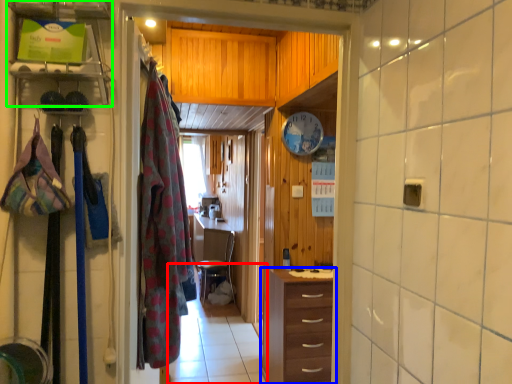
Question: Which object is positioned closest to path (highlighted by a red box)? Select from chest of drawers (highlighted by a blue box) and shelf (highlighted by a green box).

Choices:
 (A) chest of drawers
 (B) shelf

Answer: (A)